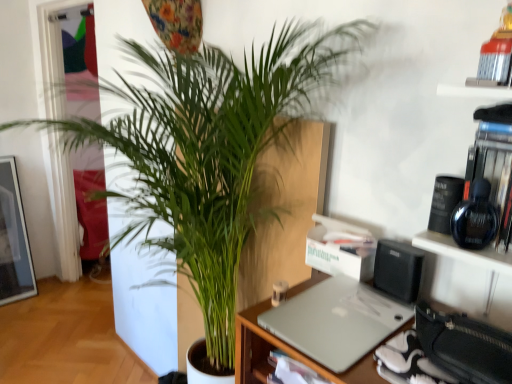
Locate an element on the screen. The image size is (512, 384). vacant point above silver metallic laptop at center (from a real-world perspective) is located at coordinates (339, 318).